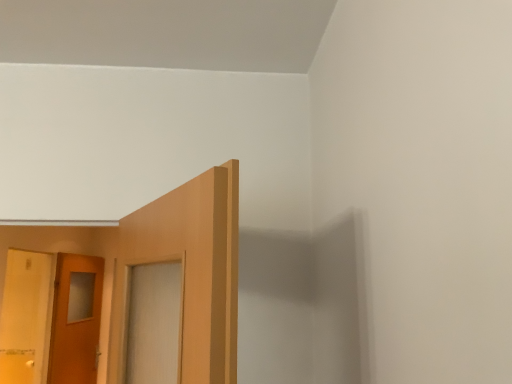
Question: Choose the correct answer: Is matte wooden door at left, the 2th door in the back-to-front sequence, inside matte wooden door at left, the 1th door from the back, or outside it?

Choices:
 (A) inside
 (B) outside

Answer: (B)

Question: From the image's perspective, is matte wooden door at left, the 2th door in the back-to-front sequence, above or below matte wooden door at left, the 1th door from the back?

Choices:
 (A) above
 (B) below

Answer: (A)

Question: From a real-world perspective, is matte wooden door at left, positioned as the 1th door in front-to-back order, physically located above or below matte wooden door at left, which is counted as the second door, starting from the front?

Choices:
 (A) below
 (B) above

Answer: (B)

Question: In terms of width, does matte wooden door at left, the 1th door from the back, look wider or thinner when compared to matte wooden door at left, the 2th door in the back-to-front sequence?

Choices:
 (A) wide
 (B) thin

Answer: (B)

Question: From a real-world perspective, is matte wooden door at left, which is counted as the second door, starting from the front, above or below matte wooden door at left, the 2th door in the back-to-front sequence?

Choices:
 (A) above
 (B) below

Answer: (B)

Question: Would you say matte wooden door at left, which is counted as the second door, starting from the front, is to the left or to the right of matte wooden door at left, positioned as the 1th door in front-to-back order, in the picture?

Choices:
 (A) right
 (B) left

Answer: (A)

Question: Considering their positions, is matte wooden door at left, the 1th door from the back, located in front of or behind matte wooden door at left, the 2th door in the back-to-front sequence?

Choices:
 (A) behind
 (B) front

Answer: (A)